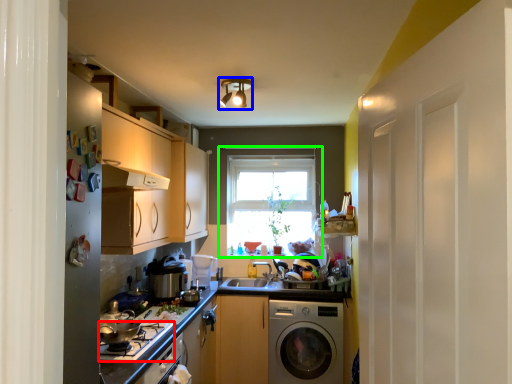
Question: Estimate the real-world distances between objects in this image. Which object is closer to gas stove (highlighted by a red box), light fixture (highlighted by a blue box) or window (highlighted by a green box)?

Choices:
 (A) light fixture
 (B) window

Answer: (A)